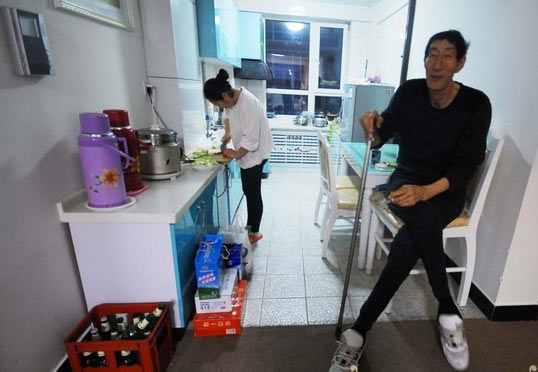
The height and width of the screenshot is (372, 538). I want to click on chairs, so click(461, 221), click(339, 200).